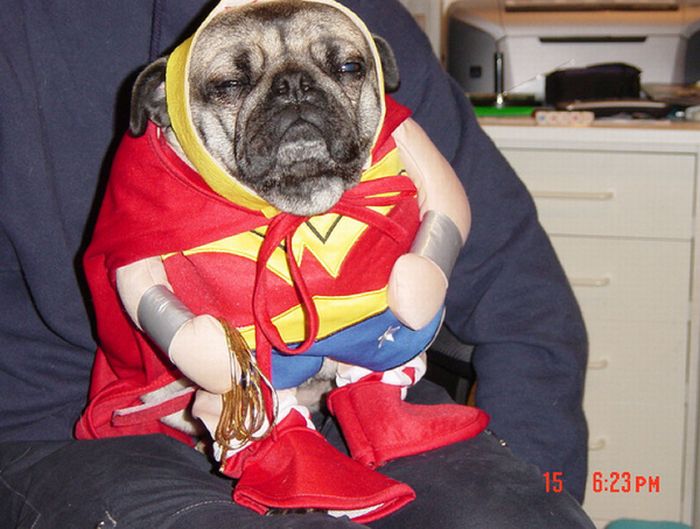
I want to click on printer, so click(x=522, y=40).